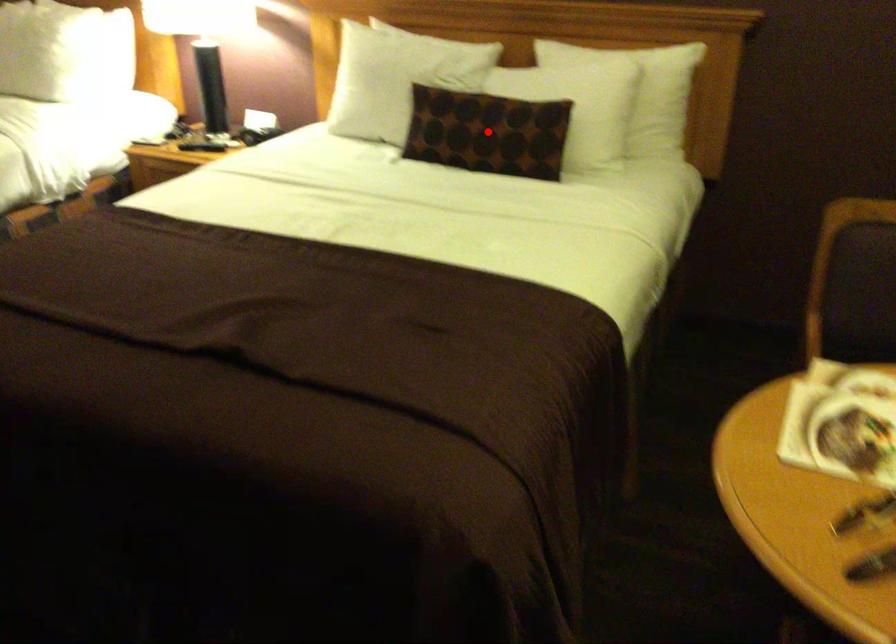
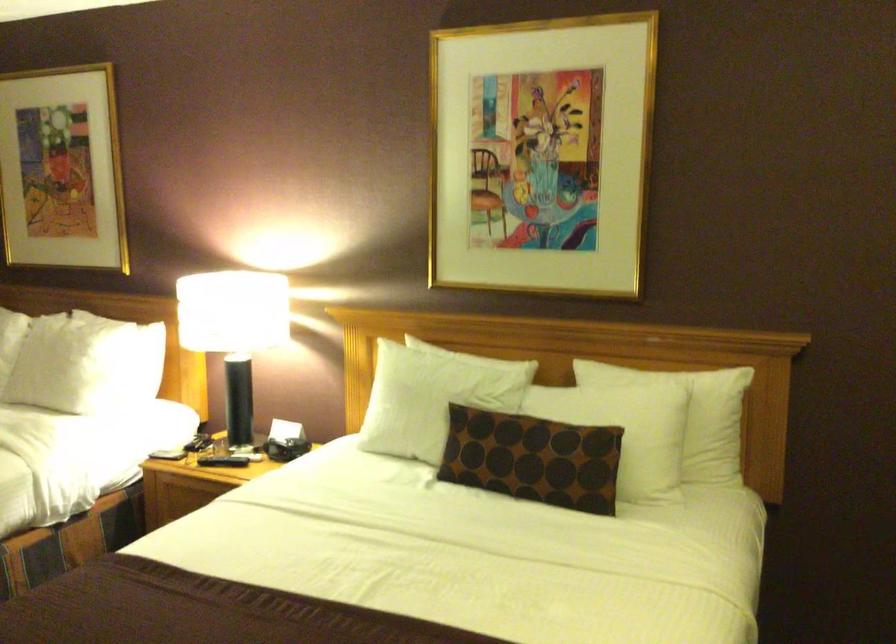
Locate, in the second image, the point that corresponds to the highlighted location in the first image.

(532, 458)